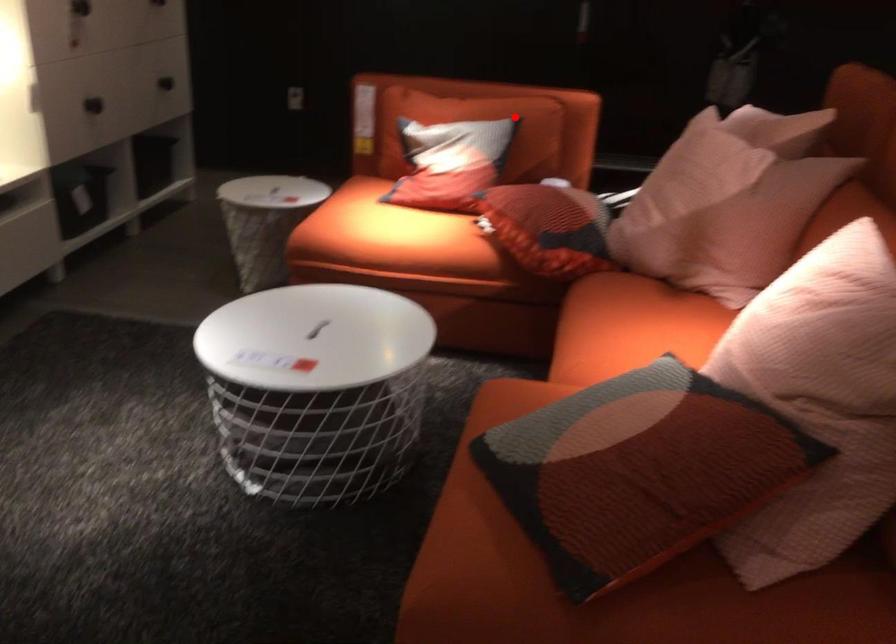
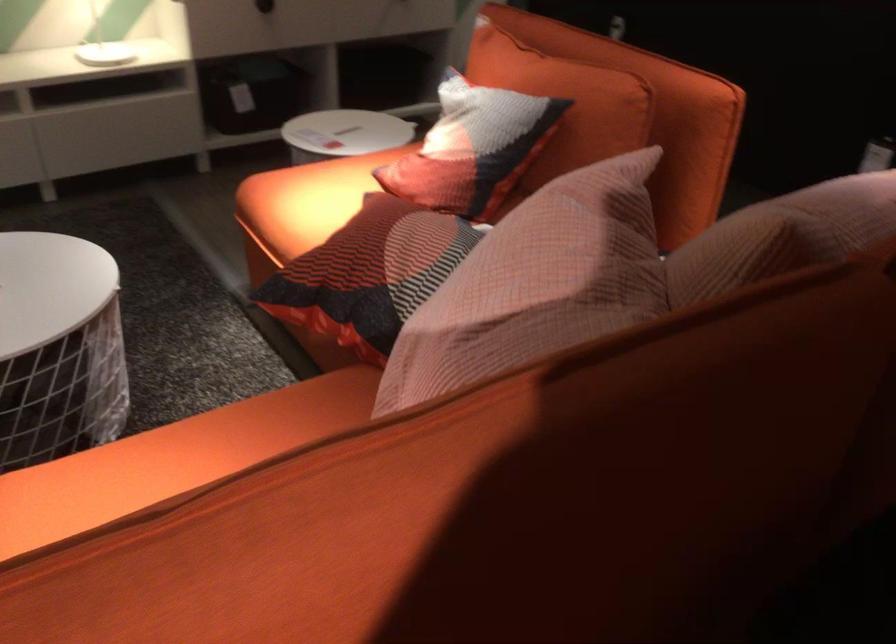
Where in the second image is the point corresponding to the highlighted location from the first image?

(564, 102)